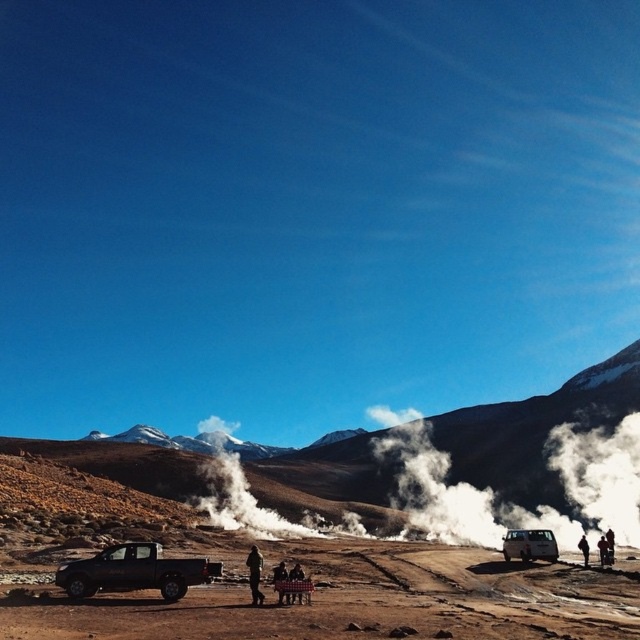
Who is lower down, brown sandy dirt field at center or matte black truck at lower left?

Positioned lower is brown sandy dirt field at center.

Does point (106, 616) come farther from viewer compared to point (100, 572)?

That is False.

The width and height of the screenshot is (640, 640). Identify the location of brown sandy dirt field at center. (355, 600).

Is dark brown leather jacket at center bigger than dark brown leather jacket at lower right?

Yes.

Who is positioned more to the right, dark brown leather jacket at center or dark brown leather jacket at lower right?

Positioned to the right is dark brown leather jacket at center.

You are a GUI agent. You are given a task and a screenshot of the screen. Output one action in this format:
    pyautogui.click(x=<x>, y=<y>)
    Task: Click on the dark brown leather jacket at center
    
    Given the screenshot: What is the action you would take?
    pyautogui.click(x=602, y=550)

Does brown sandy dirt field at center appear on the left side of dark brown leather jacket at center?

Yes, brown sandy dirt field at center is to the left of dark brown leather jacket at center.

The image size is (640, 640). What do you see at coordinates (355, 600) in the screenshot? I see `brown sandy dirt field at center` at bounding box center [355, 600].

Is point (371, 627) positioned behind point (602, 548)?

No.

At what (x,y) coordinates should I click in order to perform the action: click on brown sandy dirt field at center. Please return your answer as a coordinate pair (x, y). Looking at the image, I should click on 355,600.